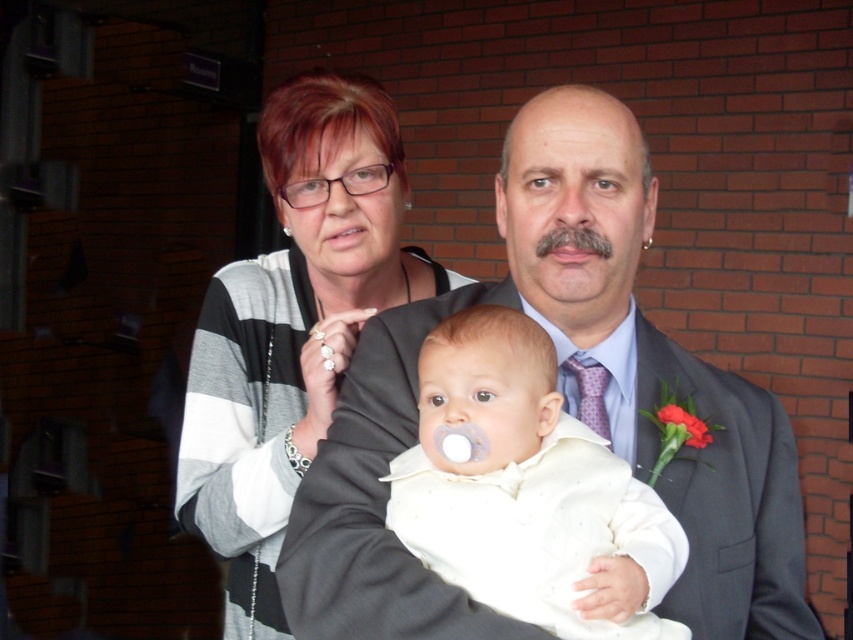
Who is taller, gray striped sweater at center or white satin baby at center?

gray striped sweater at center

Can you confirm if gray striped sweater at center is smaller than white satin baby at center?

Incorrect, gray striped sweater at center is not smaller in size than white satin baby at center.

What do you see at coordinates (292, 326) in the screenshot?
I see `gray striped sweater at center` at bounding box center [292, 326].

At what (x,y) coordinates should I click in order to perform the action: click on gray striped sweater at center. Please return your answer as a coordinate pair (x, y). The height and width of the screenshot is (640, 853). Looking at the image, I should click on (292, 326).

Is matte gray suit at center smaller than white plastic teething ring at upper center?

No.

Does point (525, 259) come farther from viewer compared to point (328, 346)?

That is False.

At what (x,y) coordinates should I click in order to perform the action: click on matte gray suit at center. Please return your answer as a coordinate pair (x, y). The height and width of the screenshot is (640, 853). Looking at the image, I should click on (563, 408).

Can you confirm if gray striped sweater at center is positioned below white plastic teething ring at upper center?

Correct, gray striped sweater at center is located below white plastic teething ring at upper center.

Measure the distance between gray striped sweater at center and camera.

gray striped sweater at center is 5.03 feet from camera.

I want to click on gray striped sweater at center, so click(292, 326).